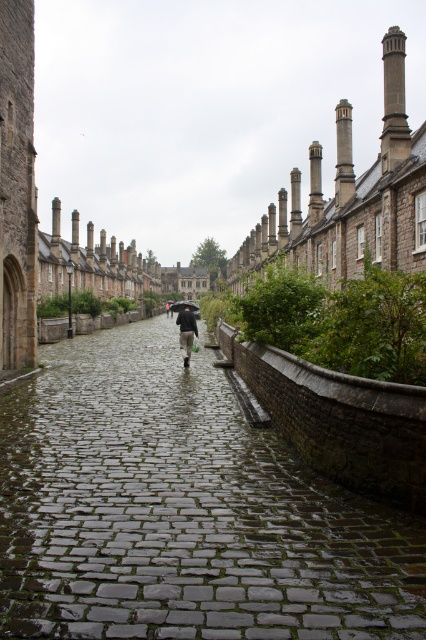
You are standing on the cobblestone street and looking at two points marked in the scene. Which point, point (196,333) or point (186,301), is closer to your current position?

Point (196,333) is closer to the camera than point (186,301), so it is closer to your current position.